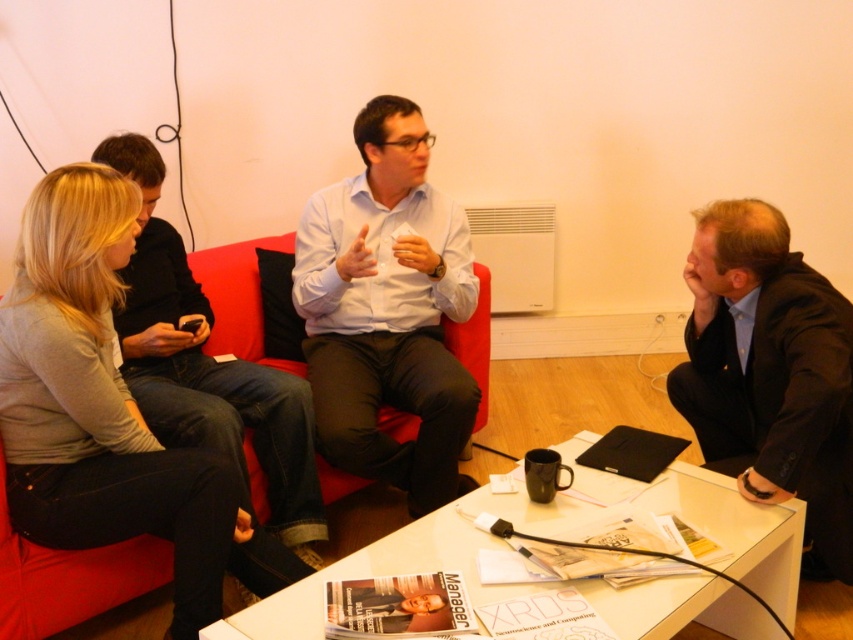
You are organizing a charity event and need to pack items from the coffee table. The light gray sweater at left and the light blue shirt at center must be placed in a box. Which item should you place first to ensure both fit properly?

The light gray sweater at left is smaller than the light blue shirt at center, so you should place the light blue shirt at center first to make sure there is enough space for the smaller sweater afterward.

You are standing in the room and want to pick up an item from the coffee table. If you first reach for the item at point [77,472] and then the item at point [798,369], which item will require you to reach further away from you?

The item at point [798,369] will require you to reach further away from you because it is farther from the viewer compared to the item at point [77,472].

You are standing in the room and want to pick up the light gray sweater at left and the dark blue suit at right. Which item is easier to reach without moving from your current position?

The light gray sweater at left is closer to the viewer, so it is easier to reach without moving.